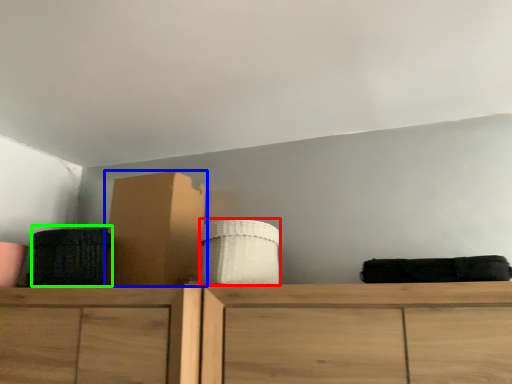
Question: Estimate the real-world distances between objects in this image. Which object is farther from basket (highlighted by a red box), cardboard box (highlighted by a blue box) or basket (highlighted by a green box)?

Choices:
 (A) cardboard box
 (B) basket

Answer: (B)